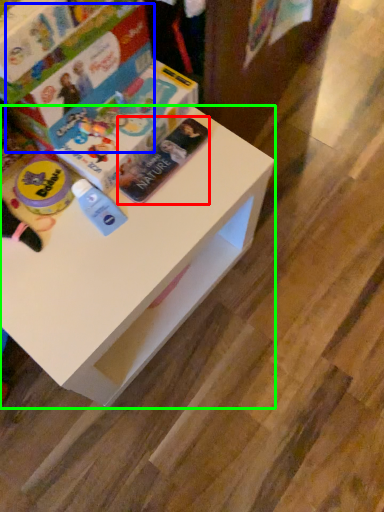
Question: Which object is the farthest from paperback book (highlighted by a red box)? Choose among these: paperback book (highlighted by a blue box) or table (highlighted by a green box).

Choices:
 (A) paperback book
 (B) table

Answer: (B)